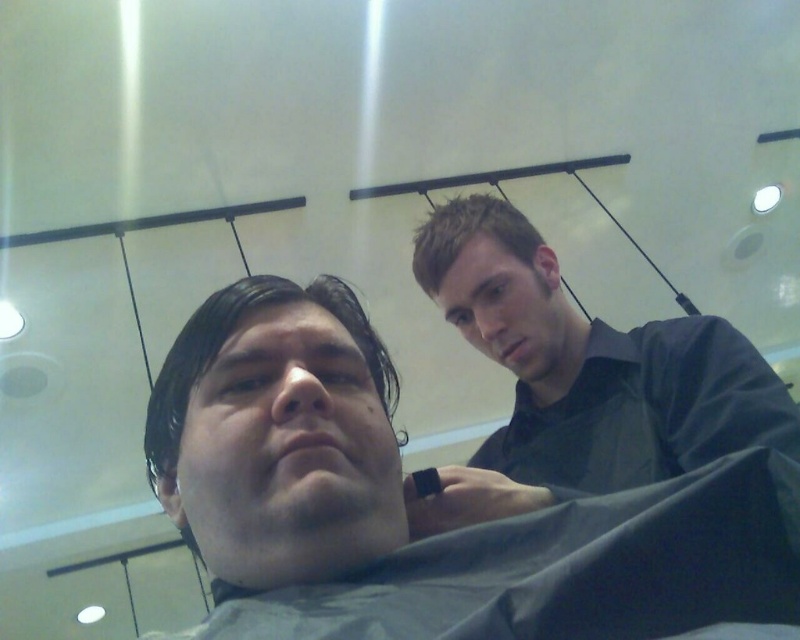
You are standing in the modern indoor setting shown in the image. You need to locate the dark gray shirt at upper right. Where exactly is it positioned in terms of coordinates?

The dark gray shirt at upper right is positioned at coordinates point (580, 378).

You are observing two people in a modern indoor setting. The person in the foreground is wearing a smooth gray shirt at center, and the person behind is wearing a dark gray shirt at upper right. Which person is positioned higher in the image?

The smooth gray shirt at center is located above the dark gray shirt at upper right, so the person wearing the smooth gray shirt at center is positioned higher in the image.

You are designing a layout for a magazine cover and need to place two elements based on their sizes. The smooth gray shirt at center and the short brown hair at upper center are the elements. Which element should you place first if you want to prioritize the larger one?

The smooth gray shirt at center should be placed first because it is wider than the short brown hair at upper center, making it the larger element.